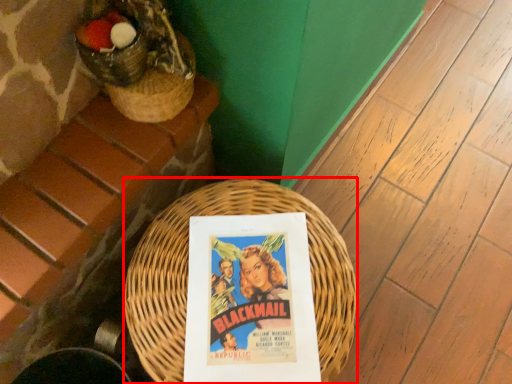
Question: From the image's perspective, what is the correct spatial positioning of basket (annotated by the red box) in reference to paperback book?

Choices:
 (A) above
 (B) below

Answer: (B)